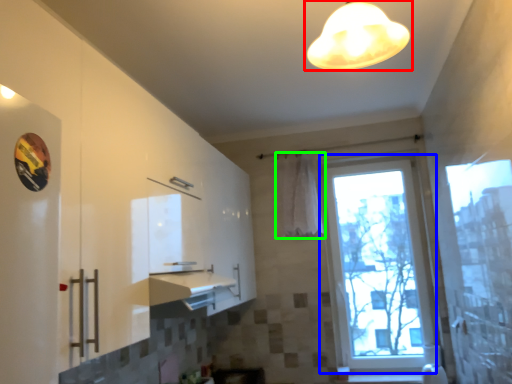
Question: Estimate the real-world distances between objects in this image. Which object is closer to lamp (highlighted by a red box), window (highlighted by a blue box) or curtain (highlighted by a green box)?

Choices:
 (A) window
 (B) curtain

Answer: (B)